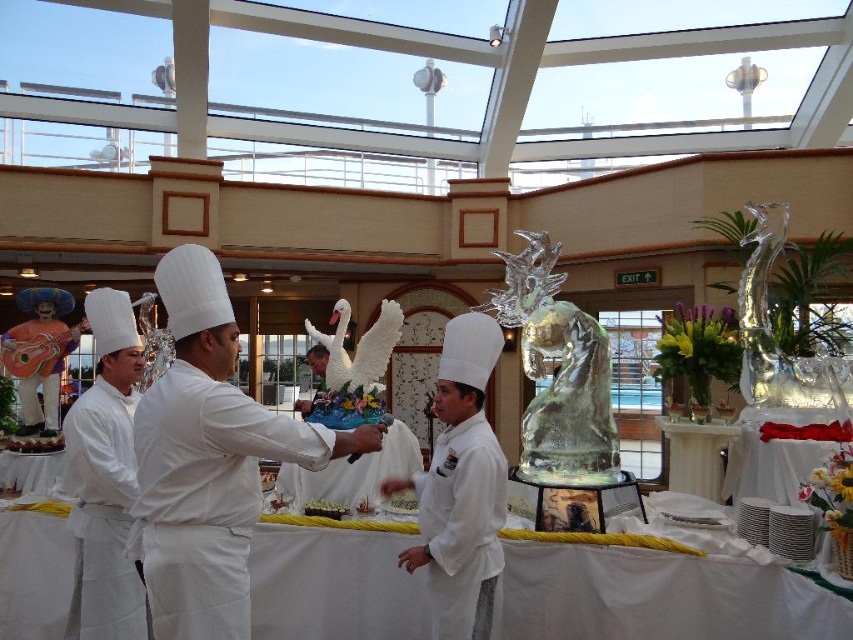
Is point (125, 548) positioned behind point (465, 595)?

No.

From the picture: Which is more to the right, white matte chef's coat at left or white matte chef's coat at center?

white matte chef's coat at center is more to the right.

Find the location of a particular element. This screenshot has height=640, width=853. white matte chef's coat at left is located at coordinates (102, 515).

Does white matte chef's coat at center appear on the left side of white fabric table at lower left?

Incorrect, white matte chef's coat at center is not on the left side of white fabric table at lower left.

Can you confirm if white matte chef's coat at center is thinner than white fabric table at lower left?

Indeed, white matte chef's coat at center has a lesser width compared to white fabric table at lower left.

Is point (492, 486) more distant than point (28, 477)?

No, (492, 486) is in front of (28, 477).

The width and height of the screenshot is (853, 640). Identify the location of white matte chef's coat at center. (462, 528).

Does white matte chef's coat at left have a lesser height compared to white glossy table at center?

Incorrect, white matte chef's coat at left's height does not fall short of white glossy table at center's.

Is white matte chef's coat at left to the left of white glossy table at center from the viewer's perspective?

Correct, you'll find white matte chef's coat at left to the left of white glossy table at center.

Identify the location of white matte chef's coat at left. The image size is (853, 640). [102, 515].

Identify the location of white matte chef's coat at left. (102, 515).